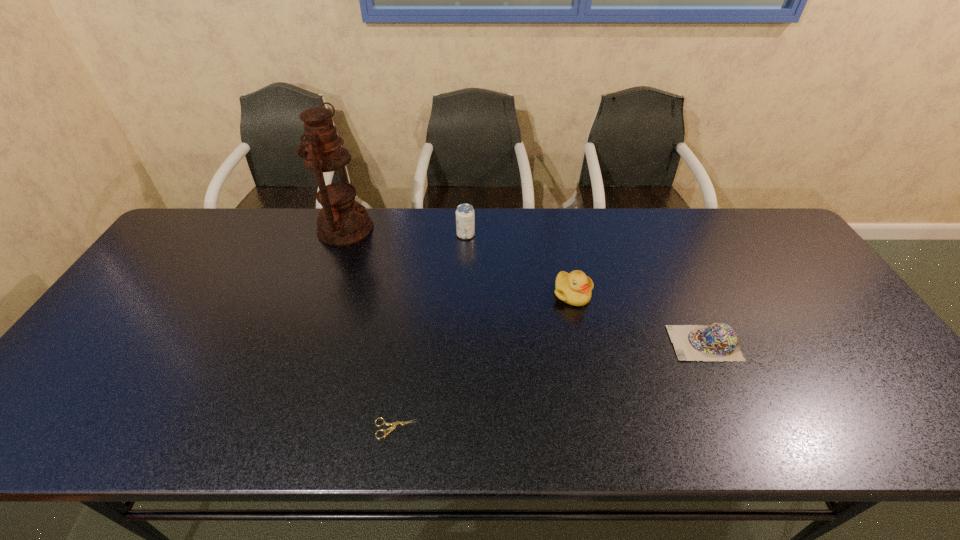
Image resolution: width=960 pixels, height=540 pixels. Find the location of `vacant area situated 0.050m on the left of the third object from left to right`. vacant area situated 0.050m on the left of the third object from left to right is located at coordinates (441, 235).

Identify the location of free space located 0.240m on the beak of the third nearest object. This screenshot has width=960, height=540. (591, 384).

Where is `free space located on the front, side, and top of the rightmost object`? free space located on the front, side, and top of the rightmost object is located at coordinates (632, 343).

Identify the location of blank space located 0.260m on the front, side, and top of the rightmost object. This screenshot has height=540, width=960. (569, 343).

Identify the location of vacant space located on the front, side, and top of the rightmost object. The height and width of the screenshot is (540, 960). (557, 343).

I want to click on blank space located 0.390m on the back of the shears, so click(416, 292).

Where is `oil lamp that is at the far edge`? oil lamp that is at the far edge is located at coordinates (342, 221).

I want to click on soda can that is at the far edge, so click(465, 215).

Identify the location of object present at the near edge. Image resolution: width=960 pixels, height=540 pixels. (394, 424).

The height and width of the screenshot is (540, 960). In the image, there is a desktop. Identify the location of vacant space at the far edge. (247, 251).